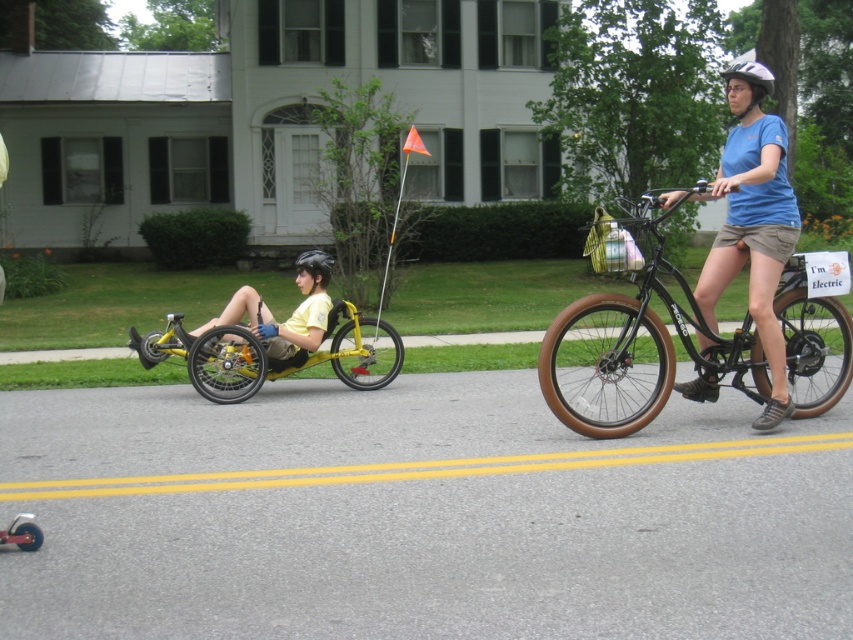
Does blue fabric shirt at upper right have a lesser height compared to yellow matte tricycle at left?

No, blue fabric shirt at upper right is not shorter than yellow matte tricycle at left.

Does blue fabric shirt at upper right appear on the left side of yellow matte tricycle at left?

In fact, blue fabric shirt at upper right is to the right of yellow matte tricycle at left.

Where is `blue fabric shirt at upper right`? The image size is (853, 640). blue fabric shirt at upper right is located at coordinates (753, 221).

Identify the location of blue fabric shirt at upper right. This screenshot has width=853, height=640. coord(753,221).

Which is below, blue fabric shirt at upper right or black matte helmet at center?

black matte helmet at center is below.

Does point (705, 300) come farther from viewer compared to point (305, 269)?

No.

Where is `blue fabric shirt at upper right`? blue fabric shirt at upper right is located at coordinates (753, 221).

Can you confirm if brown rubber bicycle at right is positioned to the left of black matte helmet at center?

Incorrect, brown rubber bicycle at right is not on the left side of black matte helmet at center.

Between brown rubber bicycle at right and black matte helmet at center, which one has more height?

With more height is brown rubber bicycle at right.

Locate an element on the screen. This screenshot has height=640, width=853. brown rubber bicycle at right is located at coordinates (635, 346).